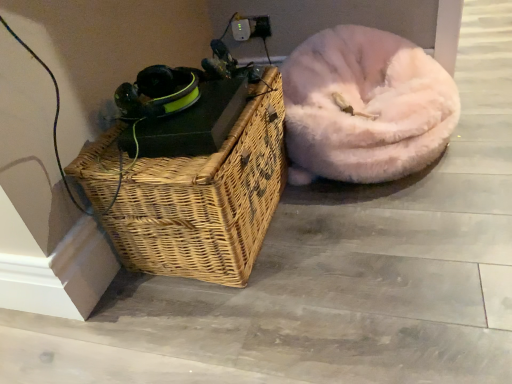
What are the coordinates of `vacant area that lies between woven wood picnic basket at lower left and fuzzy pink dog bed at right` in the screenshot? It's located at pos(342,231).